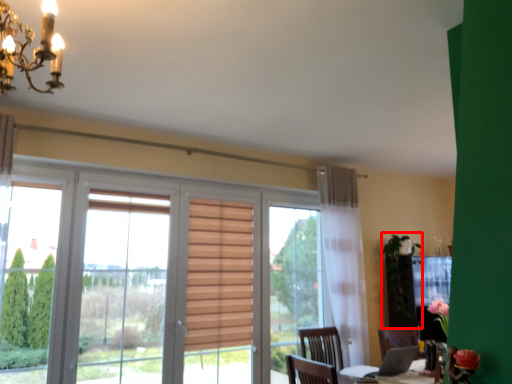
Question: From the image's perspective, what is the correct spatial relationship of plant (annotated by the red box) in relation to light fixture?

Choices:
 (A) above
 (B) below

Answer: (B)